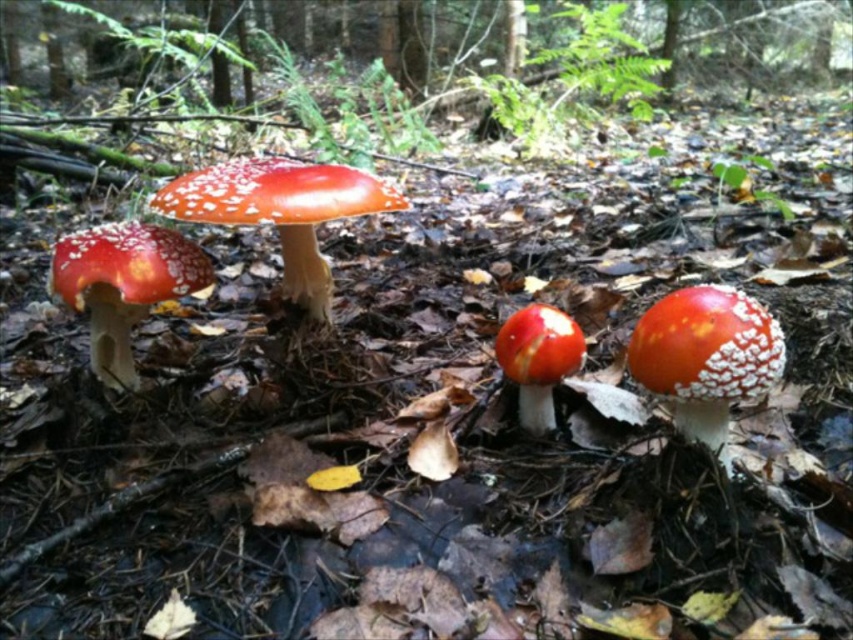
You are a mycologist examining a forest floor scene. You notice a point marked at coordinates (706, 356). Based on the scene description, which object does this point most likely correspond to?

The point at coordinates (706, 356) most likely corresponds to the smooth red mushroom at center, as it is specified in the objects description that this point marks that particular mushroom.

You are a hiker who wants to pick the smooth red mushroom at center. You are currently standing 1.5 meters away from it. Can you reach it without moving your feet?

The smooth red mushroom at center is 1.24 meters away from the viewer, so yes, you can reach it without moving your feet since you are only 1.5 meters away.